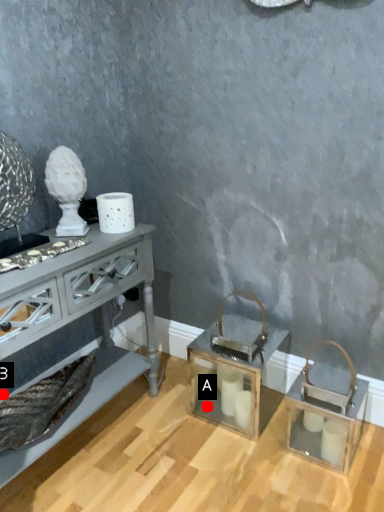
Question: Two points are circled on the image, labeled by A and B beside each circle. Among these points, which one is nearest to the camera?

Choices:
 (A) A is closer
 (B) B is closer

Answer: (B)